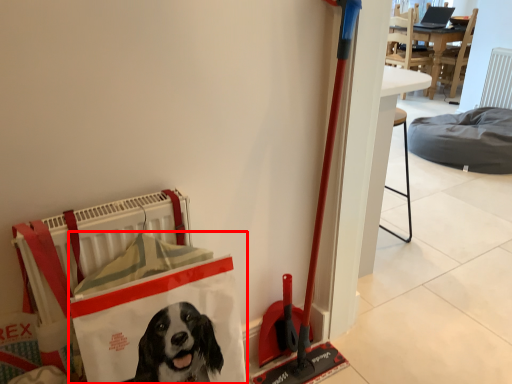
Question: Where is shopping bag (annotated by the red box) located in relation to dog bed in the image?

Choices:
 (A) right
 (B) left

Answer: (B)